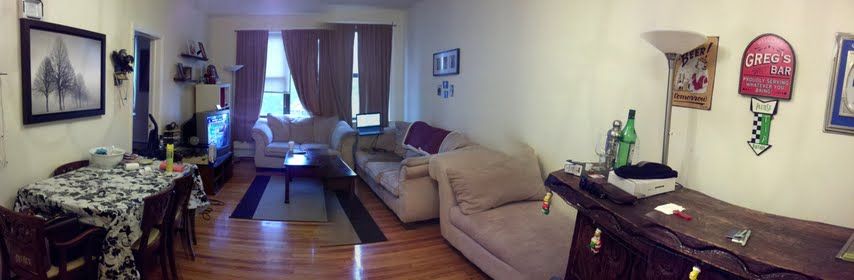
Find the location of a particular element. The image size is (854, 280). places you can sit is located at coordinates [x=38, y=247], [x=160, y=221], [x=183, y=198], [x=71, y=169], [x=278, y=133], [x=412, y=169], [x=389, y=154], [x=487, y=210].